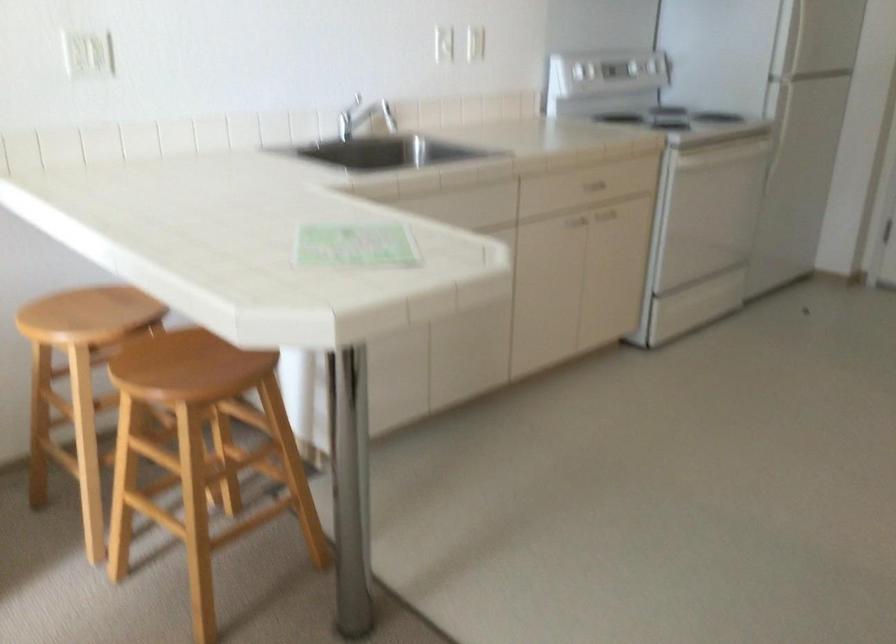
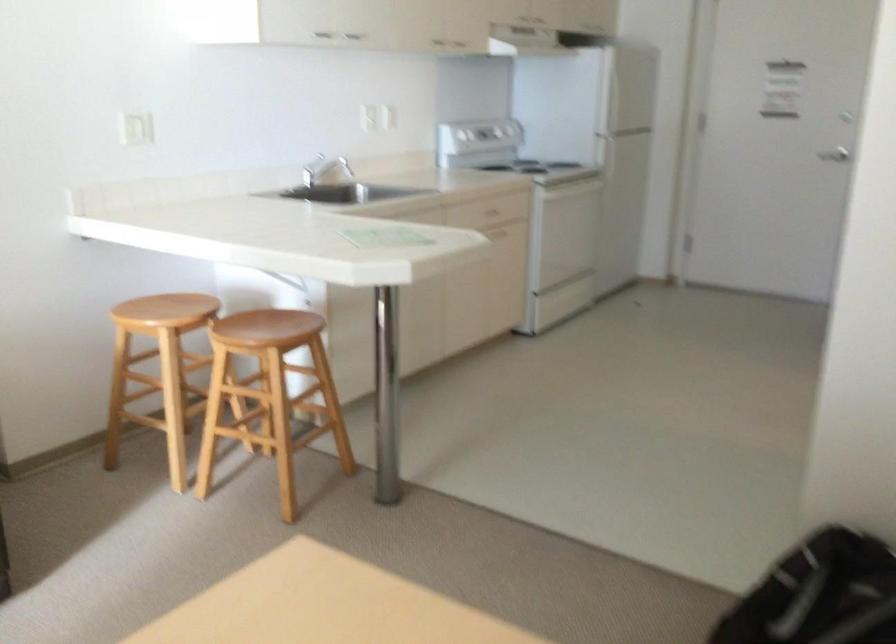
Locate, in the second image, the point that corresponds to point (366, 127) in the first image.

(317, 171)